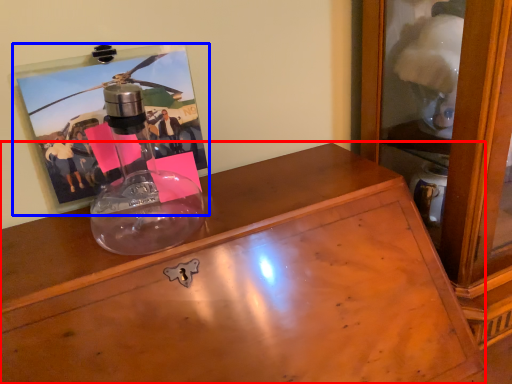
Question: Which of the following is the farthest to the observer, desk (highlighted by a red box) or picture frame (highlighted by a blue box)?

Choices:
 (A) desk
 (B) picture frame

Answer: (B)